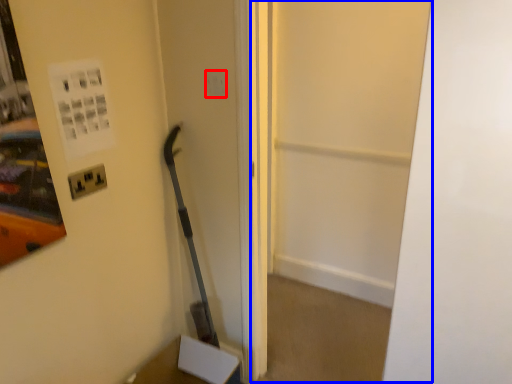
Question: Among these objects, which one is farthest to the camera, light switch (highlighted by a red box) or glass door (highlighted by a blue box)?

Choices:
 (A) light switch
 (B) glass door

Answer: (A)